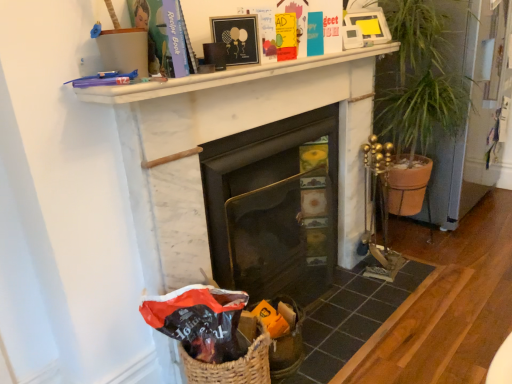
Question: Relative to black glass fireplace at center, the first fireplace in the left-to-right sequence, is matte black gift bag at lower left in front or behind?

Choices:
 (A) behind
 (B) front

Answer: (B)

Question: From a real-world perspective, is matte black gift bag at lower left positioned above or below black glass fireplace at center, positioned as the 2th fireplace in right-to-left order?

Choices:
 (A) below
 (B) above

Answer: (B)

Question: Which object is the farthest from the matte black picture frame at upper center?

Choices:
 (A) matte black gift bag at lower left
 (B) green leafy plant at right
 (C) black glass fireplace at center, the first fireplace in the left-to-right sequence
 (D) white marble fireplace at upper center
 (E) white marble fireplace at center, the first fireplace in the right-to-left sequence

Answer: (B)

Question: Based on their relative distances, which object is nearer to the matte black gift bag at lower left?

Choices:
 (A) white marble fireplace at upper center
 (B) white marble fireplace at center, the first fireplace in the right-to-left sequence
 (C) matte black picture frame at upper center
 (D) black glass fireplace at center, positioned as the 2th fireplace in right-to-left order
 (E) green leafy plant at right

Answer: (B)